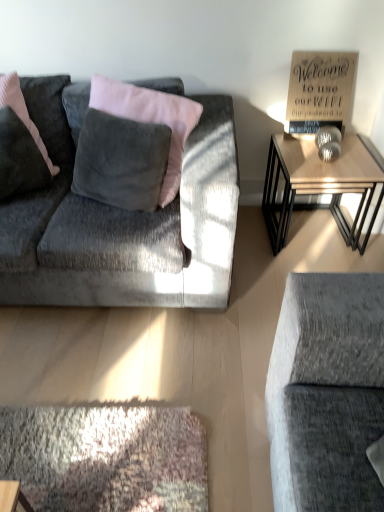
This screenshot has height=512, width=384. What are the coordinates of `vacant space situated above wooden table at right (from a real-world perspective)` in the screenshot? It's located at (319, 157).